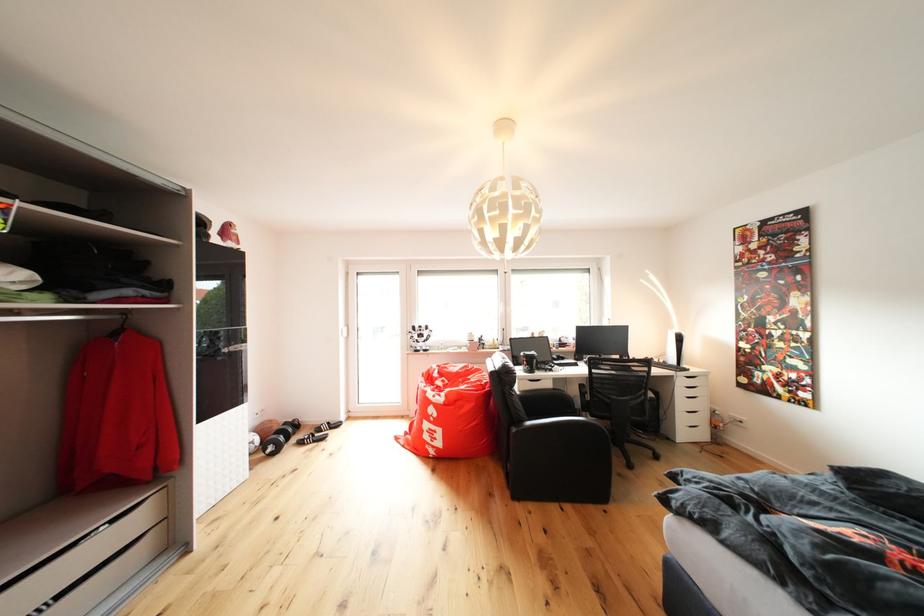
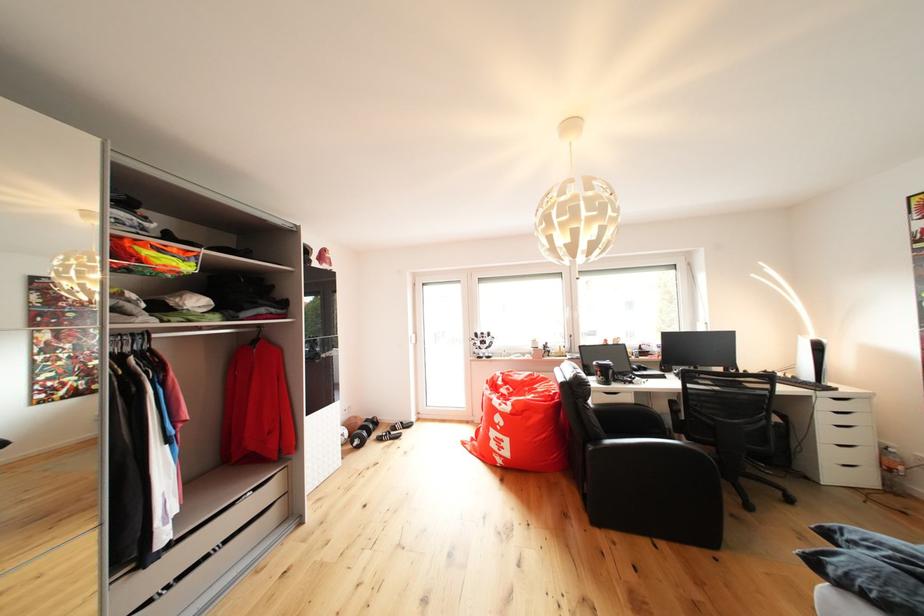
Find the pixel in the second image that matches [266,427] in the first image.

(355, 423)